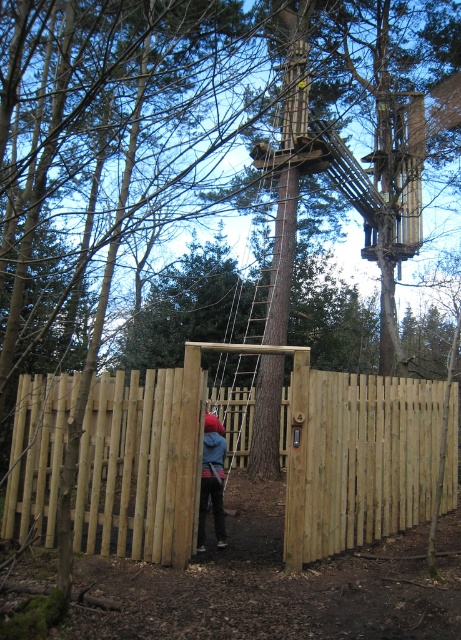
You are an adventure course guide. You need to ensure that the safety distance between the light brown wooden gate at center and the blue denim jacket at center is at least 6 feet. Based on the scene description, is the current distance sufficient?

The light brown wooden gate at center and the blue denim jacket at center are 5.32 feet apart, which is less than the required 6 feet. The current distance is not sufficient.

You are a safety inspector checking the setup for an outdoor obstacle course. You notice the light brown wooden gate at center and the blue denim jacket at center. Based on the spatial arrangement, which object occupies more horizontal space in the image?

The light brown wooden gate at center is wider than the blue denim jacket at center according to the description.

You are a participant in the obstacle course and need to pass through the light brown wooden gate at center. However, you are wearing the blue denim jacket at center. What should you do before proceeding through the gate?

The light brown wooden gate at center is positioned over the blue denim jacket at center, so you should remove the blue denim jacket at center before passing through the gate to avoid getting it caught or tangled.